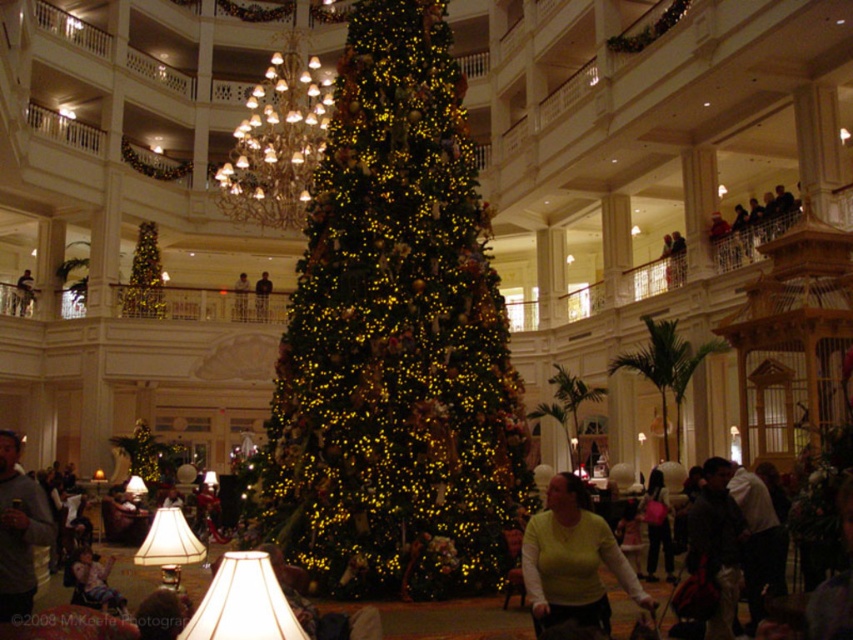
Question: Which point is closer to the camera taking this photo?

Choices:
 (A) (340, 250)
 (B) (558, 621)

Answer: (B)

Question: Estimate the real-world distances between objects in this image. Which object is closer to the shiny gold christmas tree at lower left?

Choices:
 (A) green matte christmas tree at center
 (B) light green sweater at center
 (C) matte black jacket at center
 (D) dark gray jacket at lower right

Answer: (C)

Question: Which point is closer to the camera?

Choices:
 (A) (140, 307)
 (B) (602, 552)

Answer: (B)

Question: Does green matte christmas tree at center have a larger size compared to shiny gold christmas tree at lower left?

Choices:
 (A) yes
 (B) no

Answer: (A)

Question: Is gray sweater at center wider than shiny gold christmas tree at lower left?

Choices:
 (A) yes
 (B) no

Answer: (B)

Question: Where is green matte christmas tree at center located in relation to light green sweater at center in the image?

Choices:
 (A) below
 (B) above

Answer: (B)